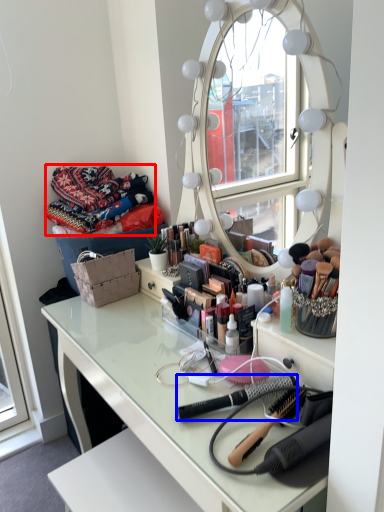
Question: Which of the following is the closest to the observer, material (highlighted by a red box) or brush (highlighted by a blue box)?

Choices:
 (A) material
 (B) brush

Answer: (B)